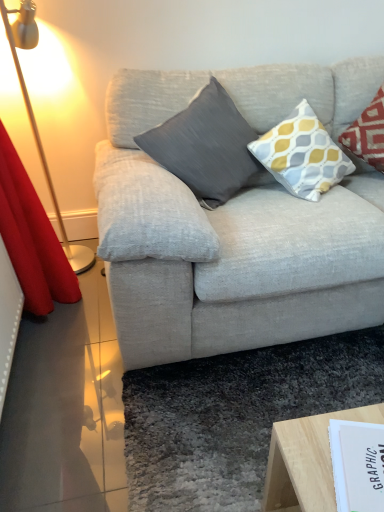
Question: From a real-world perspective, relative to yellow and gray patterned pillow at upper right, marked as the first pillow in a right-to-left arrangement, is matte gray pillow at center, placed as the 1th pillow when sorted from left to right, vertically above or below?

Choices:
 (A) below
 (B) above

Answer: (A)

Question: From the image's perspective, relative to yellow and gray patterned pillow at upper right, the second pillow in the left-to-right sequence, is matte gray pillow at center, placed as the 1th pillow when sorted from left to right, above or below?

Choices:
 (A) above
 (B) below

Answer: (B)

Question: Which object is the closest to the yellow and gray patterned pillow at upper right, marked as the first pillow in a right-to-left arrangement?

Choices:
 (A) matte gray pillow at center, placed as the 1th pillow when sorted from left to right
 (B) white paper at lower right
 (C) metallic gold floor lamp at left

Answer: (A)

Question: Which is farther from the metallic gold floor lamp at left?

Choices:
 (A) matte gray pillow at center, the 2th pillow viewed from the right
 (B) white paper at lower right
 (C) yellow and gray patterned pillow at upper right, the second pillow in the left-to-right sequence

Answer: (B)